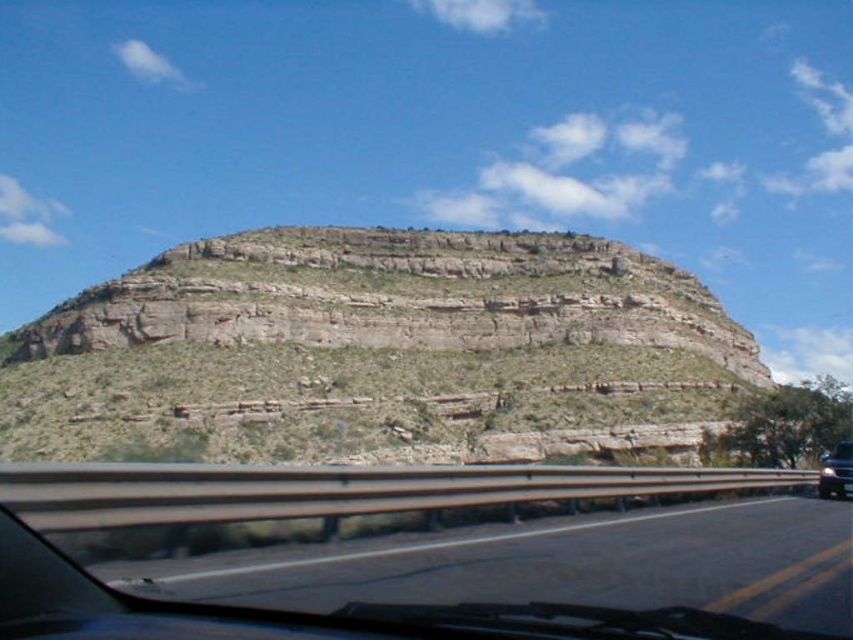
You are a passenger in the car and want to take a photo of the large mesa through the transparent glass car window at center. However, the black glossy car at right is blocking part of your view. Can you still see the entire mesa through the window?

The transparent glass car window at center is not as tall as the black glossy car at right, so the window is shorter. Since the window is shorter than the car, the black glossy car at right might block the upper part of the mesa, making it impossible to see the entire mesa through the window.

You are a passenger in the car and want to see the mesa through the transparent glass car window at center and the black glossy car at right. Which object allows you to see a wider view of the mesa?

The transparent glass car window at center allows you to see a wider view of the mesa because its width is larger than the black glossy car at right.

You are driving a car and want to know if the brown rocky mountain at center is wider than the black glossy car at right. Can you determine this based on the scene?

The brown rocky mountain at center might be wider than the black glossy car at right according to the description.